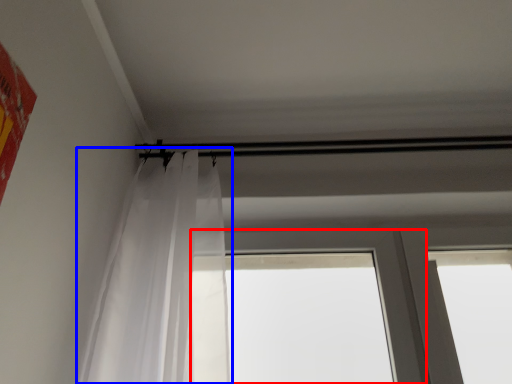
Question: Which object appears farthest to the camera in this image, window (highlighted by a red box) or curtain (highlighted by a blue box)?

Choices:
 (A) window
 (B) curtain

Answer: (A)